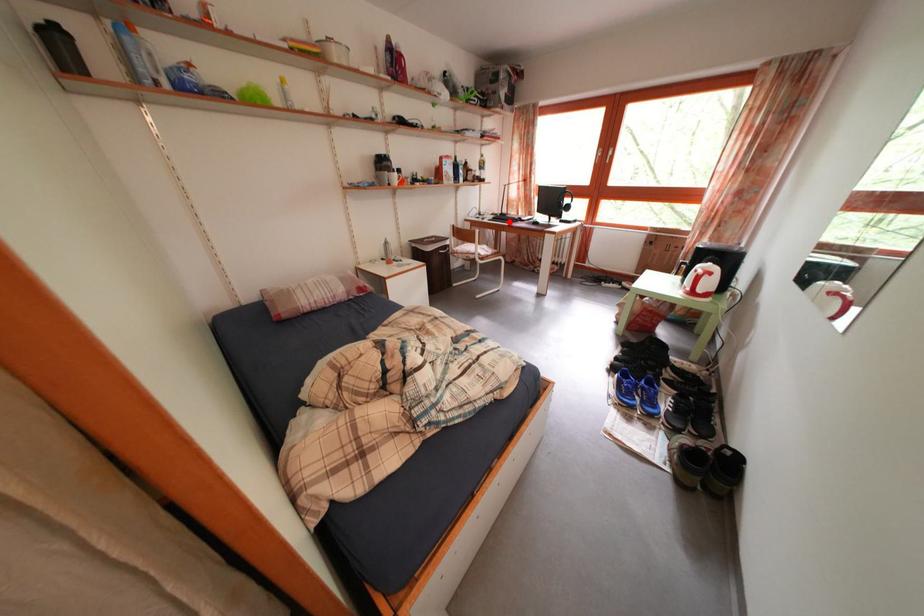
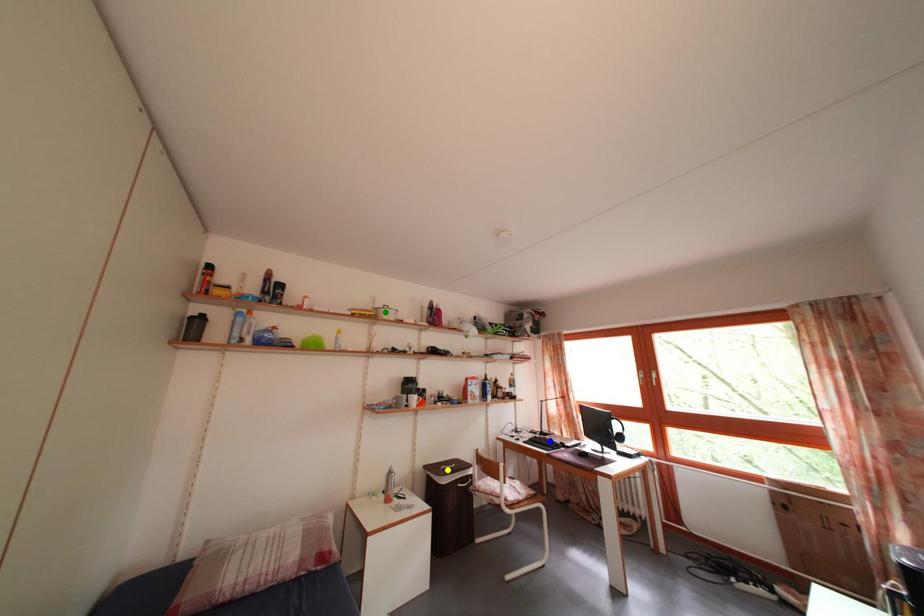
Question: I am providing you with two images of the same scene from different viewpoints. A red point is marked on the first image. You are given multiple points on the second image. Which point in image 2 is actually the same real-world point as the red point in image 1?

Choices:
 (A) blue point
 (B) yellow point
 (C) green point

Answer: (A)